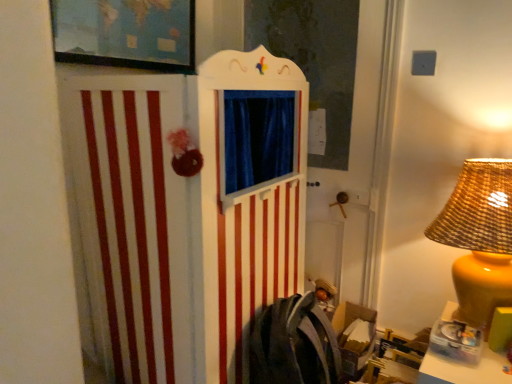
Question: From the image's perspective, is matte black picture frame at upper left located above translucent plastic container at lower right?

Choices:
 (A) no
 (B) yes

Answer: (B)

Question: From the image's perspective, is matte black picture frame at upper left located beneath translucent plastic container at lower right?

Choices:
 (A) no
 (B) yes

Answer: (A)

Question: Does matte black picture frame at upper left lie behind translucent plastic container at lower right?

Choices:
 (A) yes
 (B) no

Answer: (A)

Question: From a real-world perspective, is matte black picture frame at upper left below translucent plastic container at lower right?

Choices:
 (A) yes
 (B) no

Answer: (B)

Question: Can we say matte black picture frame at upper left lies outside translucent plastic container at lower right?

Choices:
 (A) no
 (B) yes

Answer: (B)

Question: Is matte black picture frame at upper left facing towards translucent plastic container at lower right?

Choices:
 (A) yes
 (B) no

Answer: (B)

Question: From a real-world perspective, is matte black picture frame at upper left positioned over matte yellow lampshade at right based on gravity?

Choices:
 (A) no
 (B) yes

Answer: (B)

Question: Is matte black picture frame at upper left bigger than matte yellow lampshade at right?

Choices:
 (A) no
 (B) yes

Answer: (A)

Question: Is matte black picture frame at upper left facing towards matte yellow lampshade at right?

Choices:
 (A) no
 (B) yes

Answer: (A)

Question: Does matte black picture frame at upper left have a greater width compared to matte yellow lampshade at right?

Choices:
 (A) no
 (B) yes

Answer: (A)

Question: Is there a large distance between matte black picture frame at upper left and matte yellow lampshade at right?

Choices:
 (A) yes
 (B) no

Answer: (A)

Question: From the image's perspective, is matte black picture frame at upper left under matte yellow lampshade at right?

Choices:
 (A) yes
 (B) no

Answer: (B)

Question: Can you confirm if translucent plastic container at lower right is smaller than matte yellow lampshade at right?

Choices:
 (A) no
 (B) yes

Answer: (B)